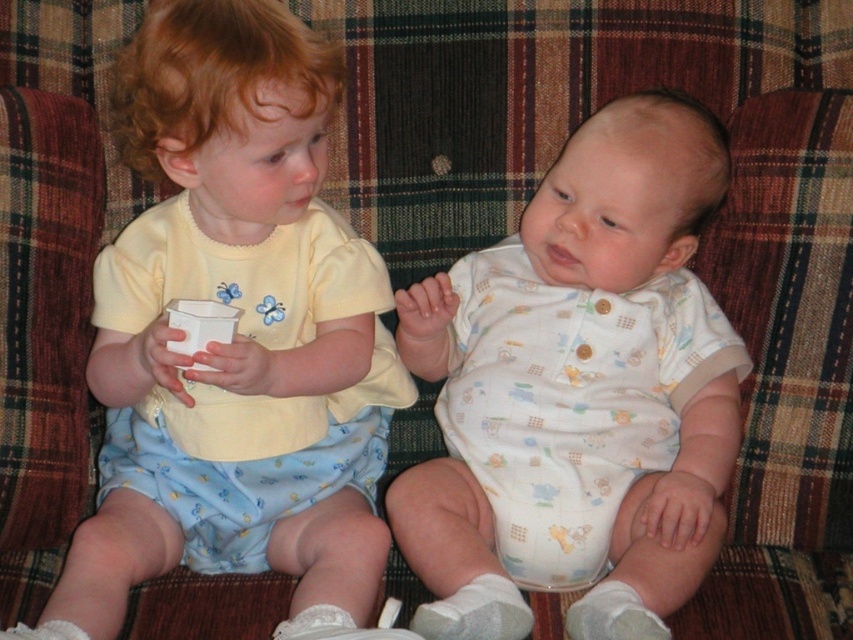
You are a toy delivery robot that needs to place a small stuffed animal between the yellow cotton shirt at left and the white cotton onesie at center. Given that the robot arm can extend 7 inches, can it reach the space between them?

The distance between the yellow cotton shirt at left and the white cotton onesie at center is 8.20 inches. Since the robot arm can only extend 7 inches, it cannot reach the space between them.

You are taking a photo of two children sitting on a plaid couch. You notice two points in the image labeled as point (215, 364) and point (657, 536). Which point is closer to the camera?

Point (215, 364) is closer to the camera than point (657, 536).